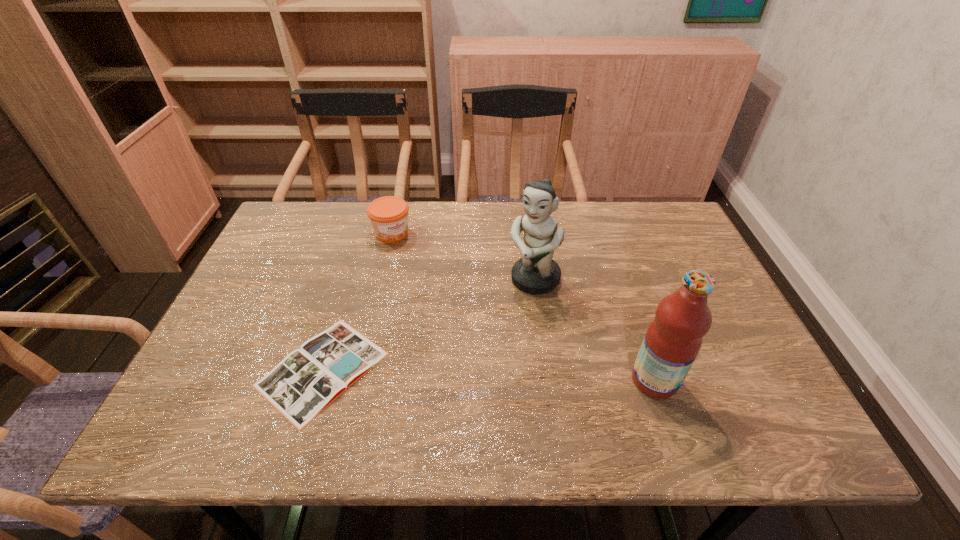
At what (x,y) coordinates should I click in order to perform the action: click on free space located on the front-facing side of the figurine. Please return your answer as a coordinate pair (x, y). This screenshot has height=540, width=960. Looking at the image, I should click on (451, 390).

The height and width of the screenshot is (540, 960). Find the location of `vacant space located on the front label of the third tallest object`. vacant space located on the front label of the third tallest object is located at coordinates (468, 312).

This screenshot has width=960, height=540. Identify the location of vacant space located 0.100m on the front label of the third tallest object. (419, 261).

The height and width of the screenshot is (540, 960). Find the location of `free spot located 0.290m on the front label of the third tallest object`. free spot located 0.290m on the front label of the third tallest object is located at coordinates (457, 300).

Where is `object at the far edge`? This screenshot has width=960, height=540. object at the far edge is located at coordinates (389, 215).

Where is `book that is at the near edge`? The height and width of the screenshot is (540, 960). book that is at the near edge is located at coordinates (306, 381).

Find the location of a particular element. fruit juice present at the near edge is located at coordinates (673, 339).

Where is `object present at the left edge`? The image size is (960, 540). object present at the left edge is located at coordinates (306, 381).

I want to click on object that is at the near left corner, so click(x=306, y=381).

Where is `vacant space at the far edge of the desktop`? vacant space at the far edge of the desktop is located at coordinates (511, 209).